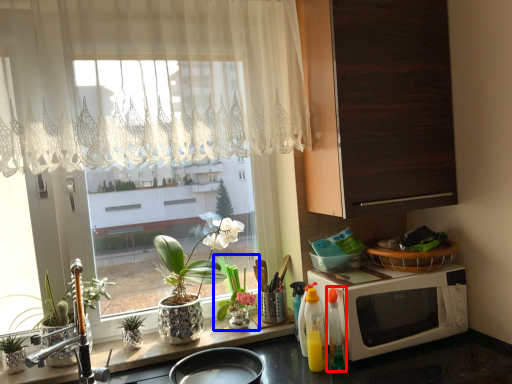
Question: Which point is closer to the camera, bottle (highlighted by a red box) or houseplant (highlighted by a blue box)?

Choices:
 (A) bottle
 (B) houseplant

Answer: (A)